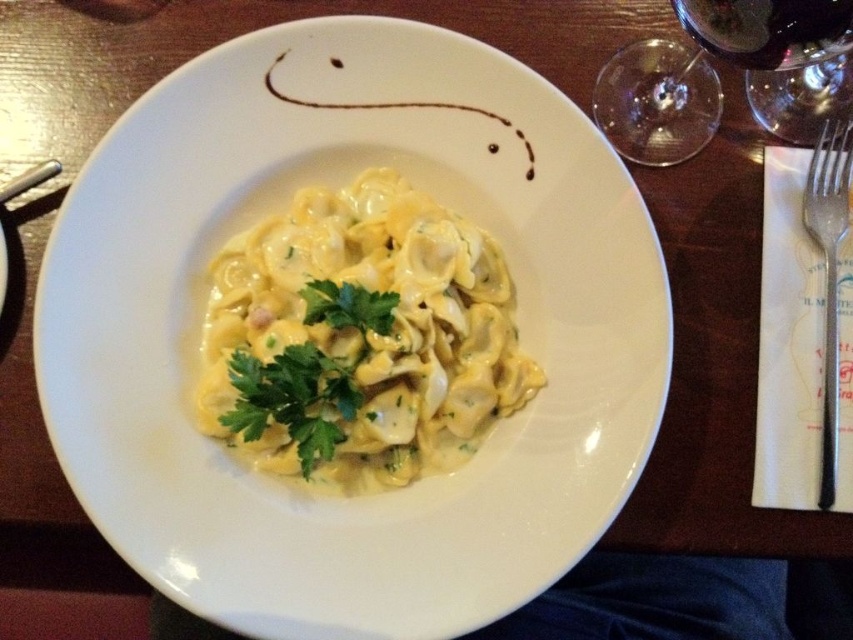
Based on the photo, you are a food critic attending a formal dinner and need to place your napkin on the table without it touching any dishes. The napkin is 20 centimeters wide. Can you safely place it between the white glossy plate at center and the transparent glass at upper right?

The distance between the white glossy plate at center and the transparent glass at upper right is 23.60 centimeters. Since the napkin is only 20 centimeters wide, there is enough space to place it between them without touching either dish.

You are a waiter who needs to place a new drink order for the customer. The customer has already placed a dark red glass at upper right on the table. Where should you place the new drink to avoid it being too close to the white glossy plate at center?

Place the new drink to the right of the dark red glass at upper right, since the white glossy plate at center is to the left of the dark red glass at upper right, leaving space on the right side for the new drink.

You are a waiter trying to place a dessert plate between the two points on the table. The first point is at coordinate point (459,480) and the second point is at point (595,104). Considering their positions, which point should you place the dessert plate closer to in order to ensure it is placed in front of the guest?

Since point (459,480) is closer to the viewer than point (595,104), placing the dessert plate closer to point (459,480) would position it in front of the guest.